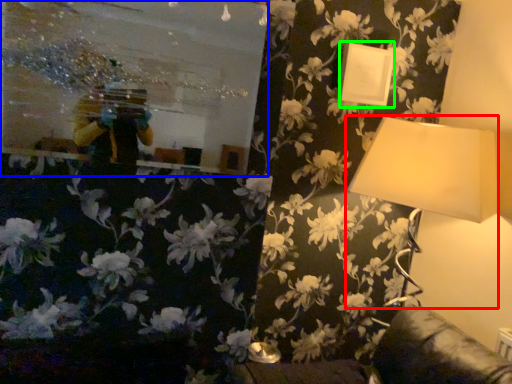
Question: Which object is positioned closest to lamp (highlighted by a red box)? Select from mirror (highlighted by a blue box) and picture frame (highlighted by a green box).

Choices:
 (A) mirror
 (B) picture frame

Answer: (B)